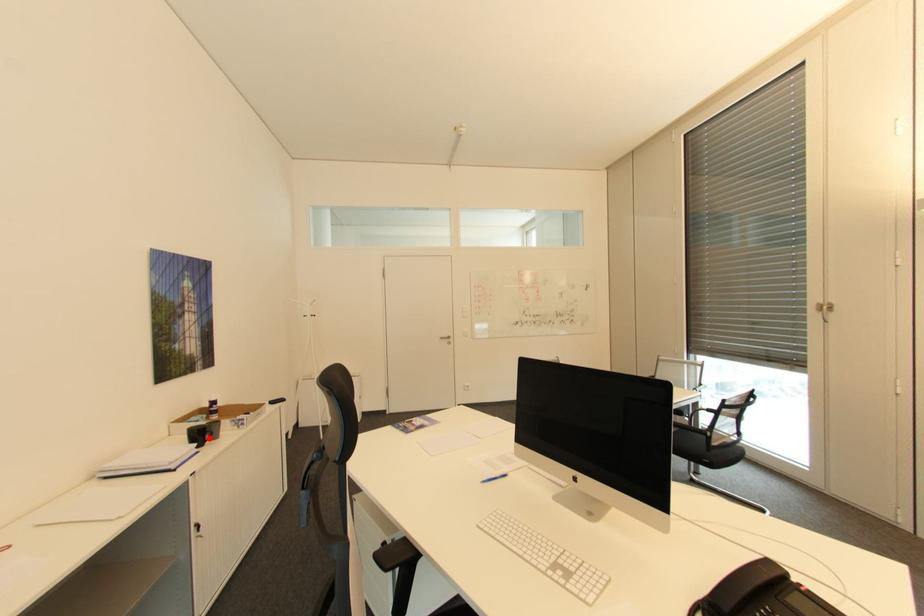
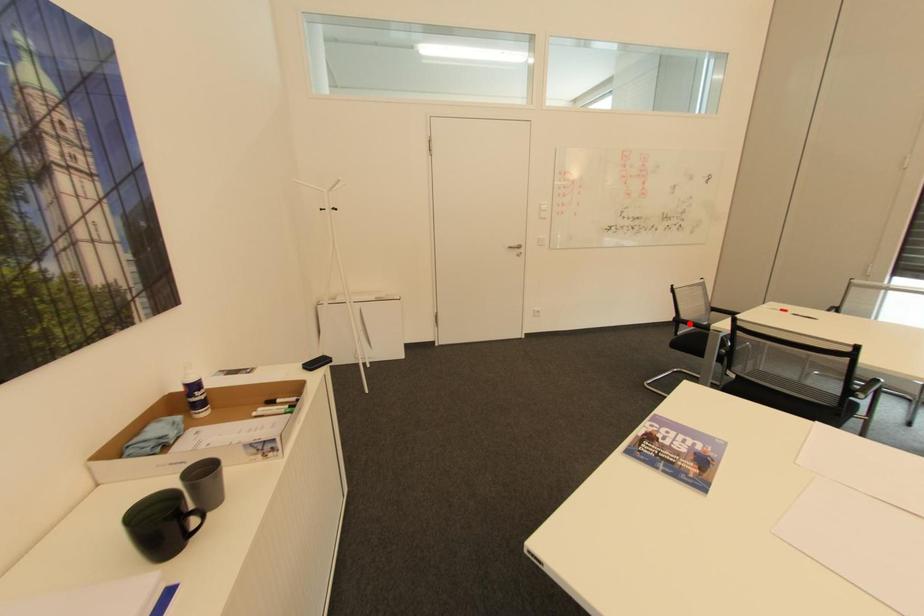
I am providing you with two images of the same scene from different viewpoints. A red point is marked on the first image and another point is marked on the second image. Are the points marked in image1 and image2 representing the same 3D position?

No